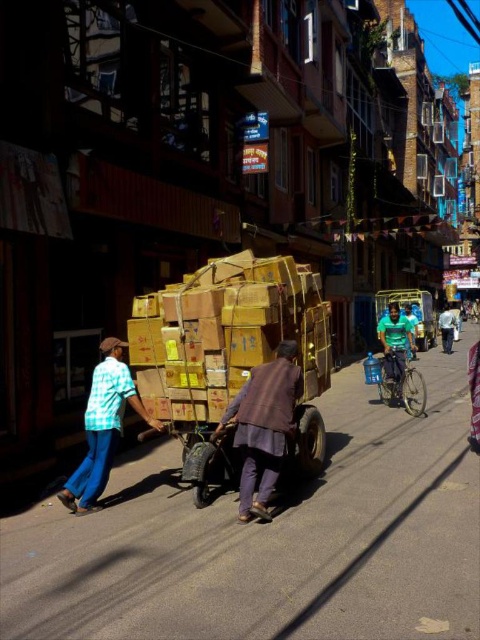
Question: Can you confirm if brown woolen coat at center is positioned below green matte shirt at center?

Choices:
 (A) no
 (B) yes

Answer: (B)

Question: Which is nearer to the green fabric shirt at right?

Choices:
 (A) green matte shirt at center
 (B) brown woolen coat at center
 (C) checkered fabric shirt at left

Answer: (B)

Question: Does brown woolen coat at center have a smaller size compared to checkered fabric shirt at left?

Choices:
 (A) yes
 (B) no

Answer: (B)

Question: Which point appears closest to the camera in this image?

Choices:
 (A) (397, 320)
 (B) (74, 497)
 (C) (445, 324)

Answer: (B)

Question: Estimate the real-world distances between objects in this image. Which object is farther from the checkered fabric shirt at left?

Choices:
 (A) brown woolen coat at center
 (B) green fabric shirt at right
 (C) green matte shirt at center

Answer: (B)

Question: Does checkered fabric shirt at left come behind green matte shirt at center?

Choices:
 (A) yes
 (B) no

Answer: (B)